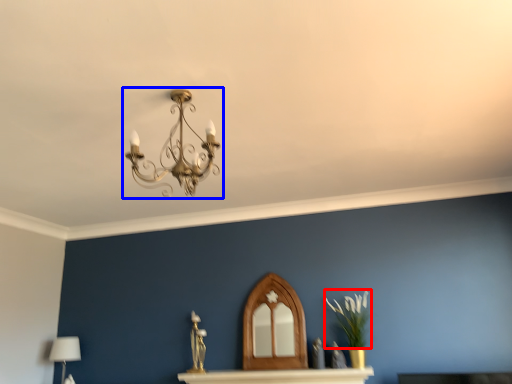
Question: Among these objects, which one is nearest to the camera, plant (highlighted by a red box) or lamp (highlighted by a blue box)?

Choices:
 (A) plant
 (B) lamp

Answer: (B)